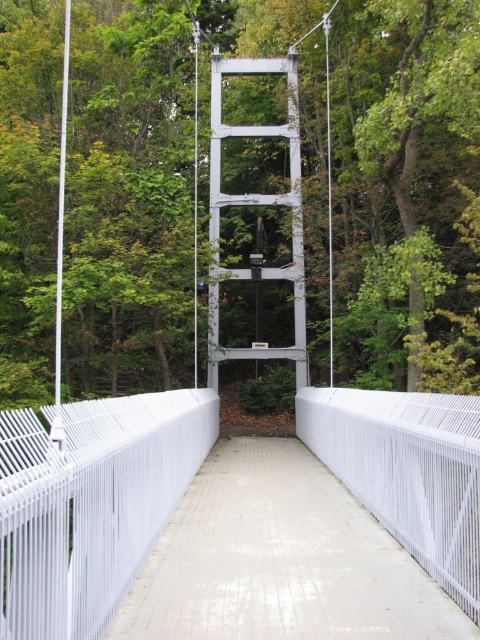
You are standing on the suspension bridge and want to take a photo of the green leafy tree at center and the white glossy concrete path at center. Which object is located to the left of the other?

The green leafy tree at center is positioned on the left side of the white glossy concrete path at center.

You are standing on the suspension bridge and looking down. You notice a green leafy tree at center and a white glossy concrete path at center. Which object is higher from the ground?

The green leafy tree at center is taller than the white glossy concrete path at center, so the green leafy tree at center is higher from the ground.

Looking at this image, you are a hiker walking on the white glossy concrete path at center. You want to take a photo of the green leafy tree at center. Which direction should you face to ensure the tree is visible in your camera view?

The green leafy tree at center is positioned over the white glossy concrete path at center, so you should face upwards to capture the tree in your photo.